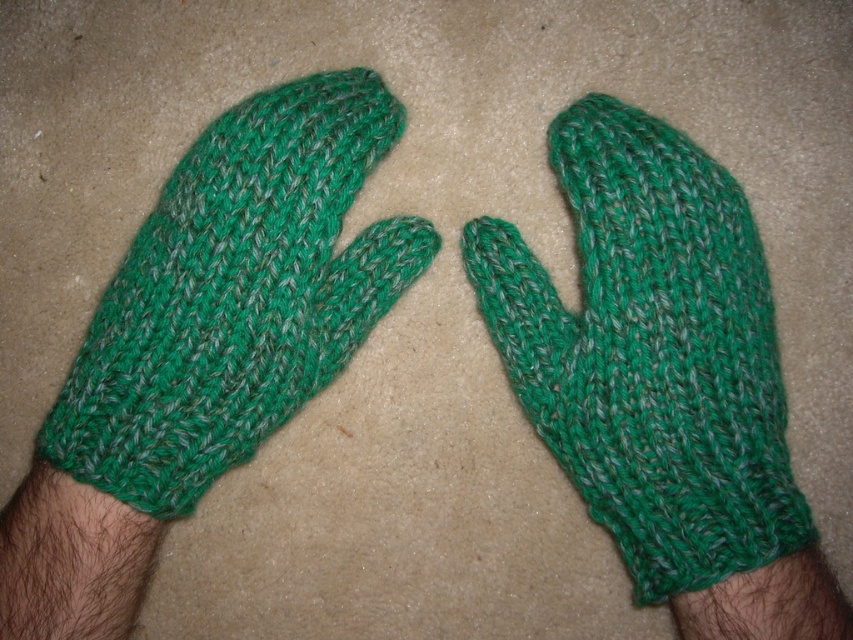
Does green knitted mitten at center have a greater width compared to green knitted mitten at left?

No, green knitted mitten at center is not wider than green knitted mitten at left.

Who is positioned more to the left, green knitted mitten at center or green knitted mitten at left?

Positioned to the left is green knitted mitten at left.

This screenshot has height=640, width=853. I want to click on green knitted mitten at center, so click(650, 352).